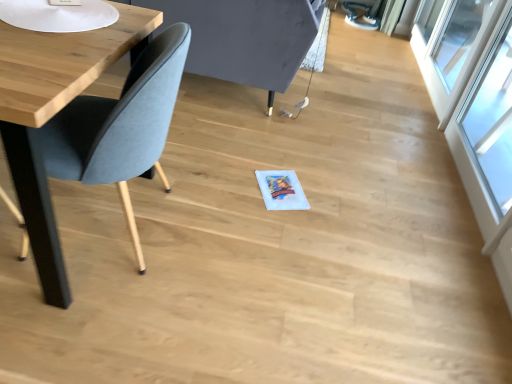
Question: Is point (452, 102) positioned closer to the camera than point (201, 8)?

Choices:
 (A) closer
 (B) farther

Answer: (B)

Question: In terms of width, does transparent glass window at upper right, acting as the second window starting from the front, look wider or thinner when compared to soft gray fabric swivel chair at left?

Choices:
 (A) wide
 (B) thin

Answer: (B)

Question: Based on their relative distances, which object is farther from the transparent glass window at upper right, which is the 1th window from back to front?

Choices:
 (A) soft gray fabric swivel chair at left
 (B) matte blue chair at left
 (C) transparent glass window at right, marked as the second window in a back-to-front arrangement

Answer: (B)

Question: Considering the real-world distances, which object is closest to the matte blue chair at left?

Choices:
 (A) transparent glass window at upper right, acting as the second window starting from the front
 (B) transparent glass window at right, marked as the second window in a back-to-front arrangement
 (C) soft gray fabric swivel chair at left

Answer: (C)